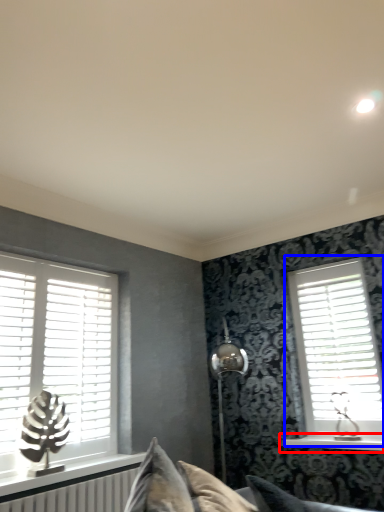
Question: Among these objects, which one is nearest to the camera, window sill (highlighted by a red box) or window (highlighted by a blue box)?

Choices:
 (A) window sill
 (B) window

Answer: (A)